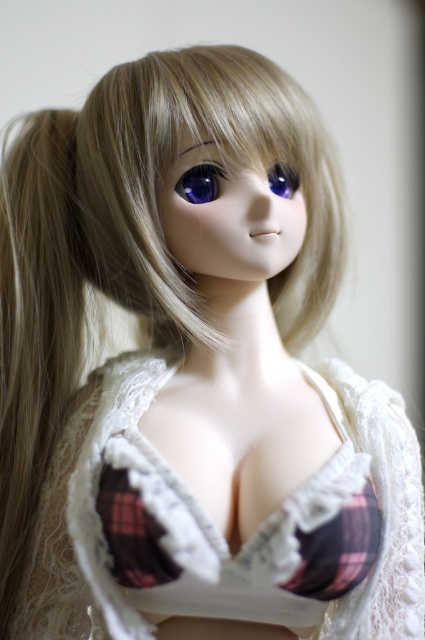
Based on the photo, who is higher up, plaid fabric bra at center or glossy plastic eye at center?

Positioned higher is glossy plastic eye at center.

Who is more distant from viewer, (53, 545) or (214, 180)?

The point (214, 180) is more distant.

What do you see at coordinates (217, 532) in the screenshot? The image size is (425, 640). I see `plaid fabric bra at center` at bounding box center [217, 532].

You are a GUI agent. You are given a task and a screenshot of the screen. Output one action in this format:
    pyautogui.click(x=<x>, y=<y>)
    Task: Click on the plaid fabric bra at center
    The image size is (425, 640).
    Given the screenshot: What is the action you would take?
    pyautogui.click(x=217, y=532)

Which is below, plaid fabric bra at center or matte brown eyebrow at upper center?

Positioned lower is plaid fabric bra at center.

Who is taller, plaid fabric bra at center or matte brown eyebrow at upper center?

With more height is plaid fabric bra at center.

Who is more forward, (379, 632) or (224, 154)?

Point (379, 632)

The height and width of the screenshot is (640, 425). I want to click on plaid fabric bra at center, so click(x=217, y=532).

Which is more to the left, plaid fabric bra at center or purple glossy eye at center?

plaid fabric bra at center

Who is positioned more to the right, plaid fabric bra at center or purple glossy eye at center?

From the viewer's perspective, purple glossy eye at center appears more on the right side.

Which is behind, point (85, 509) or point (285, 196)?

The point (285, 196) is more distant.

At what (x,y) coordinates should I click in order to perform the action: click on plaid fabric bra at center. Please return your answer as a coordinate pair (x, y). The image size is (425, 640). Looking at the image, I should click on (217, 532).